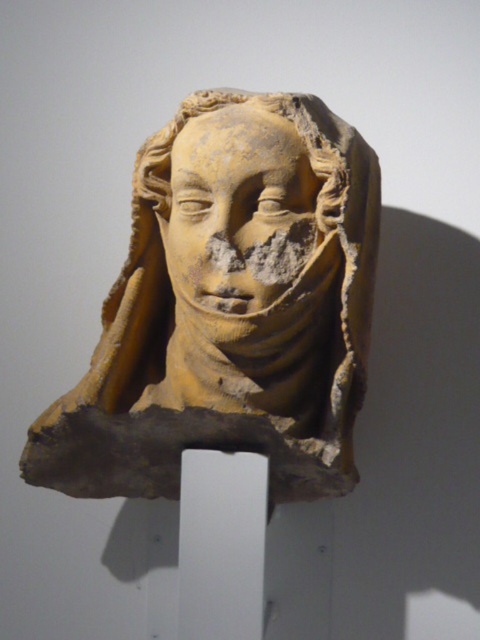
Question: Is earthenware sculpture at center wider than earthy clay face at center?

Choices:
 (A) yes
 (B) no

Answer: (A)

Question: Can you confirm if earthenware sculpture at center is smaller than earthy clay face at center?

Choices:
 (A) yes
 (B) no

Answer: (B)

Question: Is earthenware sculpture at center smaller than earthy clay face at center?

Choices:
 (A) no
 (B) yes

Answer: (A)